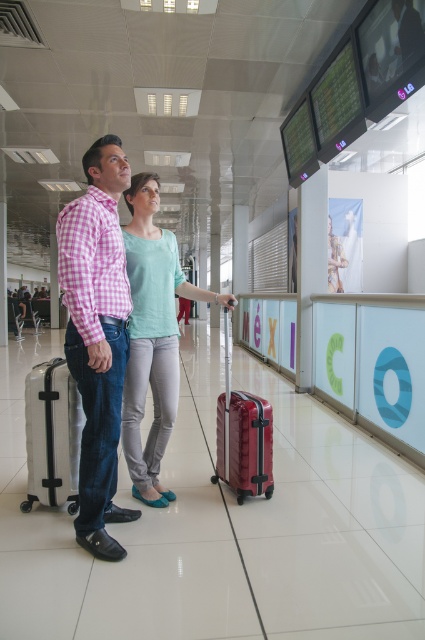
Question: Which point is closer to the camera?

Choices:
 (A) (229, 300)
 (B) (122, 364)

Answer: (B)

Question: Does pink checkered shirt at center appear on the right side of black hardshell suitcase at left?

Choices:
 (A) yes
 (B) no

Answer: (A)

Question: Which point appears farthest from the camera in this image?

Choices:
 (A) (266, 458)
 (B) (167, 493)
 (C) (57, 257)
 (D) (54, 433)

Answer: (C)

Question: In this image, where is black hardshell suitcase at left located relative to matte red suitcase at center?

Choices:
 (A) above
 (B) below

Answer: (B)

Question: Is pink checkered shirt at center wider than matte red suitcase at center?

Choices:
 (A) no
 (B) yes

Answer: (A)

Question: Among these points, which one is nearest to the camera?

Choices:
 (A) (98, 308)
 (B) (166, 490)
 (C) (232, 460)
 (D) (67, 456)

Answer: (A)